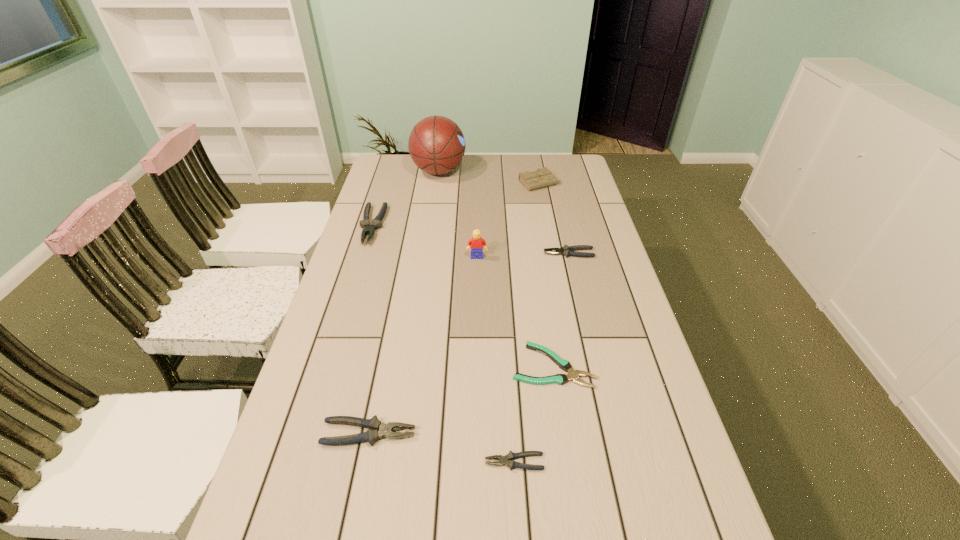
You are a GUI agent. You are given a task and a screenshot of the screen. Output one action in this format:
    pyautogui.click(x=<x>, y=<y>)
    Task: Click on the free region located at the gripping part of the sixth tallest object
    The height and width of the screenshot is (540, 960).
    Given the screenshot: What is the action you would take?
    pos(481,253)

Where is `free region located at the gripping part of the sixth tallest object`? The height and width of the screenshot is (540, 960). free region located at the gripping part of the sixth tallest object is located at coordinates (516, 253).

You are a GUI agent. You are given a task and a screenshot of the screen. Output one action in this format:
    pyautogui.click(x=<x>, y=<y>)
    Task: Click on the vacant space located 0.170m at the gripping part of the third gray pliers from left to right
    
    Given the screenshot: What is the action you would take?
    pyautogui.click(x=406, y=462)

This screenshot has width=960, height=540. I want to click on blank space located 0.090m at the gripping part of the third gray pliers from left to right, so tap(444, 462).

Locate an element on the screen. free region located at the gripping part of the third gray pliers from left to right is located at coordinates (383, 462).

In order to click on vacant space situated 0.270m on the left of the eighth tallest object in this screenshot , I will do `click(407, 366)`.

Where is `basketball situated at the far edge`? This screenshot has width=960, height=540. basketball situated at the far edge is located at coordinates (436, 144).

The width and height of the screenshot is (960, 540). In order to click on diary situated at the far edge in this screenshot , I will do [542, 177].

Identify the location of basketball that is positioned at the left edge. (436, 144).

Where is `diary at the right edge`? This screenshot has width=960, height=540. diary at the right edge is located at coordinates (542, 177).